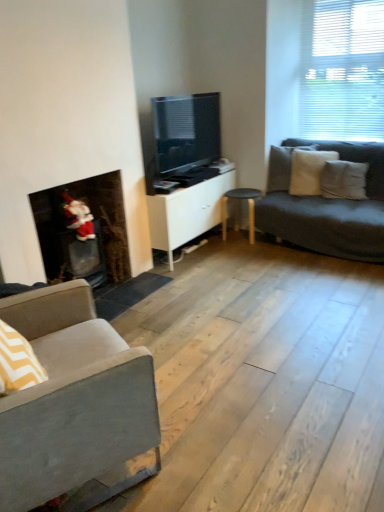
Question: Is gray fabric couch at left at the back of matte black tv at center?

Choices:
 (A) no
 (B) yes

Answer: (A)

Question: From the image's perspective, is matte black tv at center located beneath gray fabric couch at left?

Choices:
 (A) no
 (B) yes

Answer: (A)

Question: Is matte black tv at center thinner than gray fabric couch at left?

Choices:
 (A) no
 (B) yes

Answer: (B)

Question: Is gray fabric couch at left a part of matte black tv at center?

Choices:
 (A) no
 (B) yes

Answer: (A)

Question: Is matte black tv at center located outside gray fabric couch at left?

Choices:
 (A) no
 (B) yes

Answer: (B)

Question: Is white soft pillow at right, placed as the first pillow when sorted from right to left, taller or shorter than black wood stool at center?

Choices:
 (A) short
 (B) tall

Answer: (A)

Question: Based on their sizes in the image, would you say white soft pillow at right, which is the third pillow in left-to-right order, is bigger or smaller than black wood stool at center?

Choices:
 (A) big
 (B) small

Answer: (B)

Question: Choose the correct answer: Is white soft pillow at right, placed as the first pillow when sorted from right to left, inside black wood stool at center or outside it?

Choices:
 (A) inside
 (B) outside

Answer: (B)

Question: In the image, is white soft pillow at right, placed as the first pillow when sorted from right to left, positioned in front of or behind black wood stool at center?

Choices:
 (A) behind
 (B) front

Answer: (B)

Question: From their relative heights in the image, would you say black wood stool at center is taller or shorter than velvet santa at left?

Choices:
 (A) tall
 (B) short

Answer: (B)

Question: In the image, is black wood stool at center on the left side or the right side of velvet santa at left?

Choices:
 (A) right
 (B) left

Answer: (A)

Question: From the image's perspective, is black wood stool at center positioned above or below velvet santa at left?

Choices:
 (A) above
 (B) below

Answer: (A)

Question: Considering the positions of black wood stool at center and velvet santa at left in the image, is black wood stool at center wider or thinner than velvet santa at left?

Choices:
 (A) wide
 (B) thin

Answer: (A)

Question: Considering the positions of point (337, 51) and point (321, 183), is point (337, 51) closer or farther from the camera than point (321, 183)?

Choices:
 (A) closer
 (B) farther

Answer: (B)

Question: Is white blinds at upper right in front of or behind white soft pillow at right, placed as the first pillow when sorted from right to left, in the image?

Choices:
 (A) front
 (B) behind

Answer: (A)